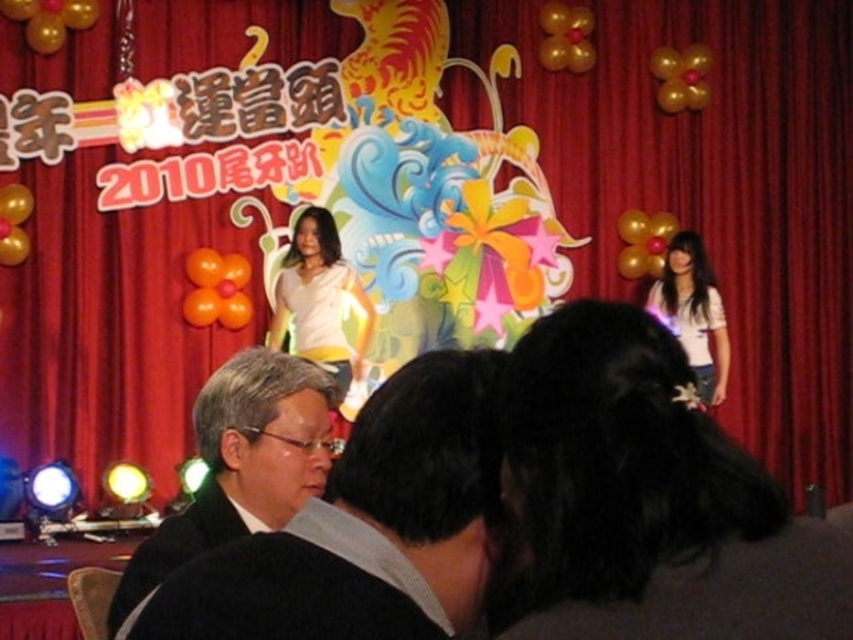
Question: Does black matte suit at lower left lie in front of white matte shirt at center?

Choices:
 (A) no
 (B) yes

Answer: (B)

Question: Estimate the real-world distances between objects in this image. Which object is closer to the black matte suit at lower left?

Choices:
 (A) white matte shirt at right
 (B) white matte shirt at center

Answer: (B)

Question: Is white matte shirt at center below white matte shirt at right?

Choices:
 (A) yes
 (B) no

Answer: (B)

Question: Which point appears farthest from the camera in this image?

Choices:
 (A) (352, 294)
 (B) (692, 358)
 (C) (407, 396)

Answer: (B)

Question: Can you confirm if black matte suit at lower left is positioned to the right of white matte shirt at center?

Choices:
 (A) no
 (B) yes

Answer: (B)

Question: Which object is closer to the camera taking this photo?

Choices:
 (A) white matte shirt at right
 (B) white matte shirt at center

Answer: (A)